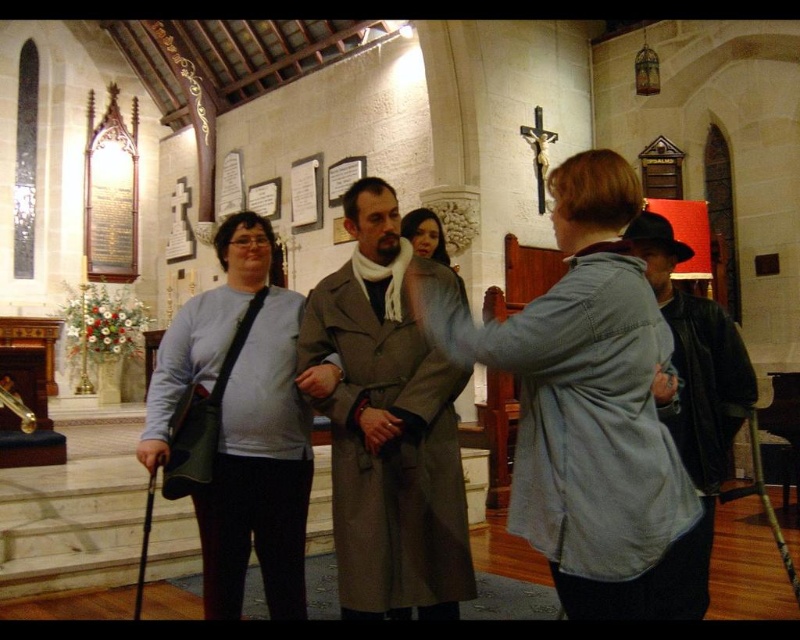
Can you confirm if denim jacket at center is positioned above dark brown leather jacket at right?

Incorrect, denim jacket at center is not positioned above dark brown leather jacket at right.

Which is above, denim jacket at center or dark brown leather jacket at right?

dark brown leather jacket at right is above.

Who is more distant from viewer, (550, 524) or (724, 472)?

The point (724, 472) is behind.

I want to click on denim jacket at center, so click(x=590, y=410).

Between point (454, 468) and point (297, 305), which one is positioned in front?

Positioned in front is point (454, 468).

Who is more forward, (x=406, y=256) or (x=270, y=387)?

Point (x=270, y=387) is in front.

The height and width of the screenshot is (640, 800). Find the location of `light brown wool coat at center`. light brown wool coat at center is located at coordinates (388, 428).

Does point (645, 420) lie in front of point (222, 435)?

Yes, point (645, 420) is closer to viewer.

Does denim jacket at center have a smaller size compared to light blue sweater at center?

Incorrect, denim jacket at center is not smaller in size than light blue sweater at center.

Where is `denim jacket at center`? Image resolution: width=800 pixels, height=640 pixels. denim jacket at center is located at coordinates (590, 410).